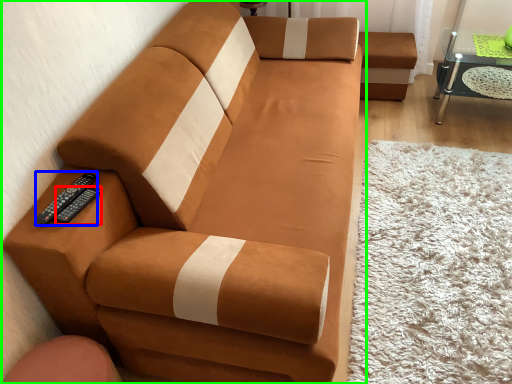
Question: Estimate the real-world distances between objects in this image. Which object is closer to remote (highlighted by a red box), remote (highlighted by a blue box) or studio couch (highlighted by a green box)?

Choices:
 (A) remote
 (B) studio couch

Answer: (A)